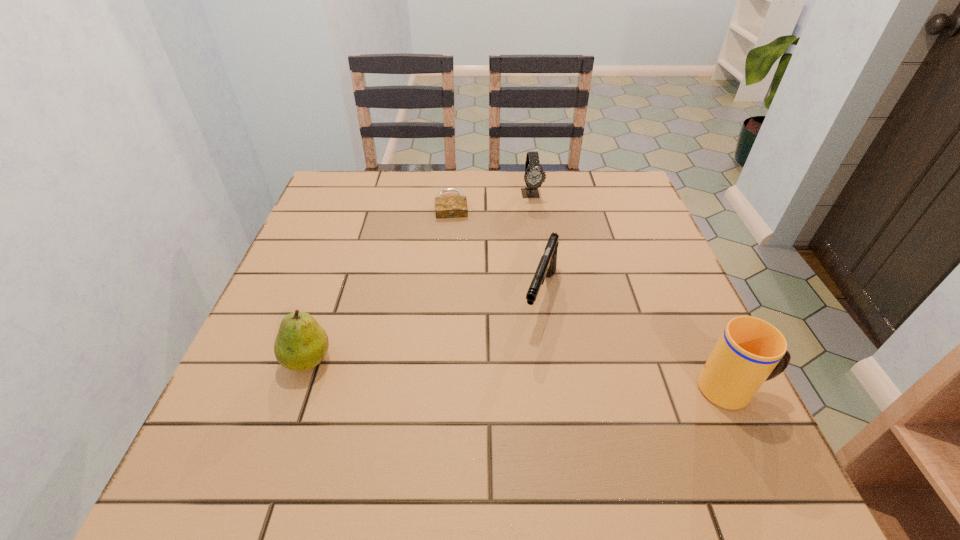
Identify the location of pear. (301, 344).

This screenshot has height=540, width=960. In order to click on cup in this screenshot , I will do `click(750, 351)`.

Where is `gun`? The width and height of the screenshot is (960, 540). gun is located at coordinates (546, 268).

The image size is (960, 540). What are the coordinates of `padlock` in the screenshot? It's located at (446, 206).

Identify the location of the fourth object from right to left. (446, 206).

You are a GUI agent. You are given a task and a screenshot of the screen. Output one action in this format:
    pyautogui.click(x=<x>, y=<y>)
    Task: Click on the watch
    This screenshot has height=540, width=960.
    Given the screenshot: What is the action you would take?
    pyautogui.click(x=534, y=176)

Identify the location of free space located on the right of the leftmost object. Image resolution: width=960 pixels, height=540 pixels. (521, 360).

Image resolution: width=960 pixels, height=540 pixels. I want to click on vacant space located at the aiming end of the third nearest object, so click(x=505, y=424).

The height and width of the screenshot is (540, 960). I want to click on free location located at the aiming end of the third nearest object, so click(x=521, y=378).

What are the coordinates of `vacant area situated 0.160m at the aiming end of the third nearest object` in the screenshot? It's located at (516, 395).